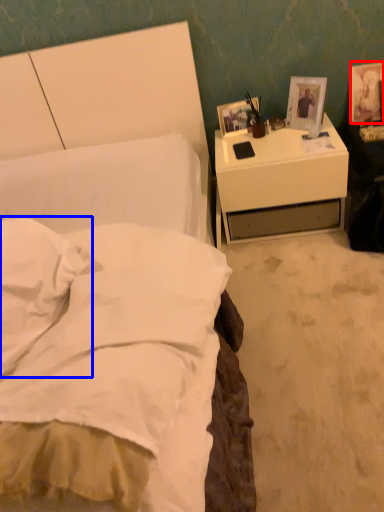
Question: Which of the following is the farthest to the observer, picture frame (highlighted by a red box) or pillow (highlighted by a blue box)?

Choices:
 (A) picture frame
 (B) pillow

Answer: (A)